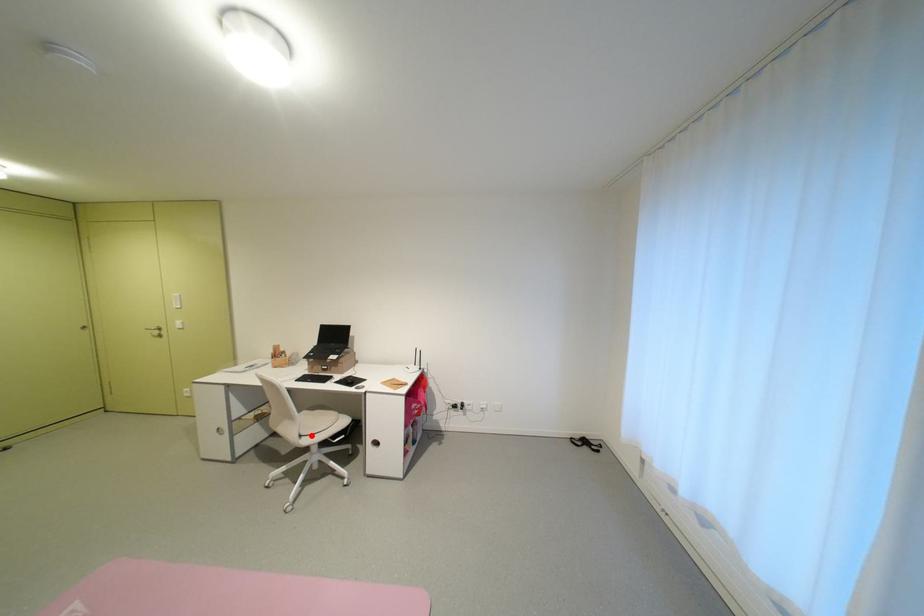
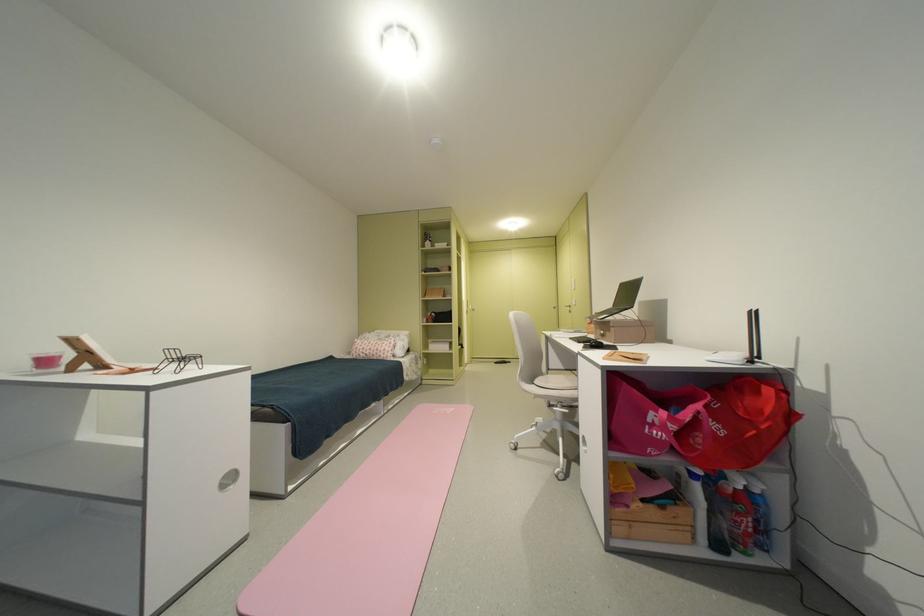
Find the pixel in the second image that matches the highlighted location in the first image.

(543, 383)